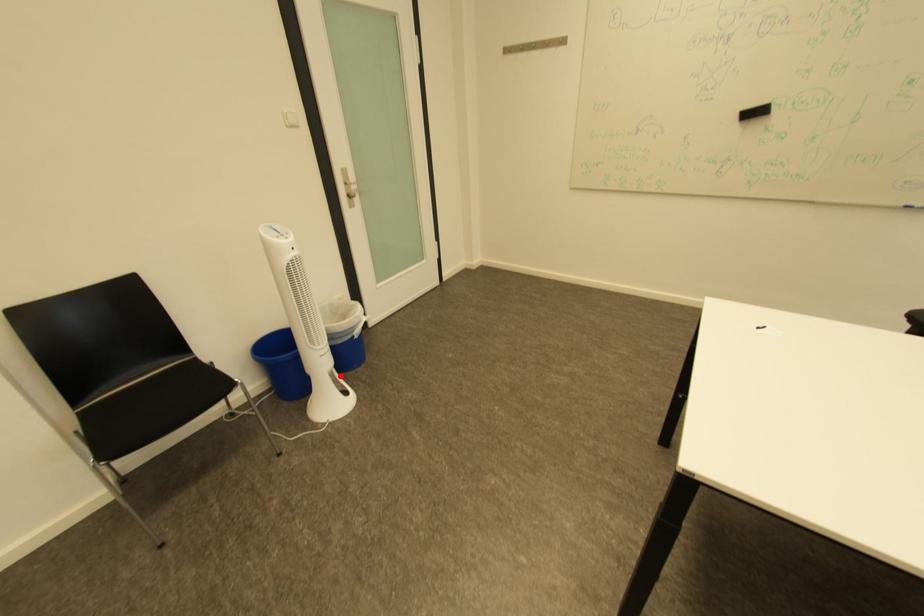
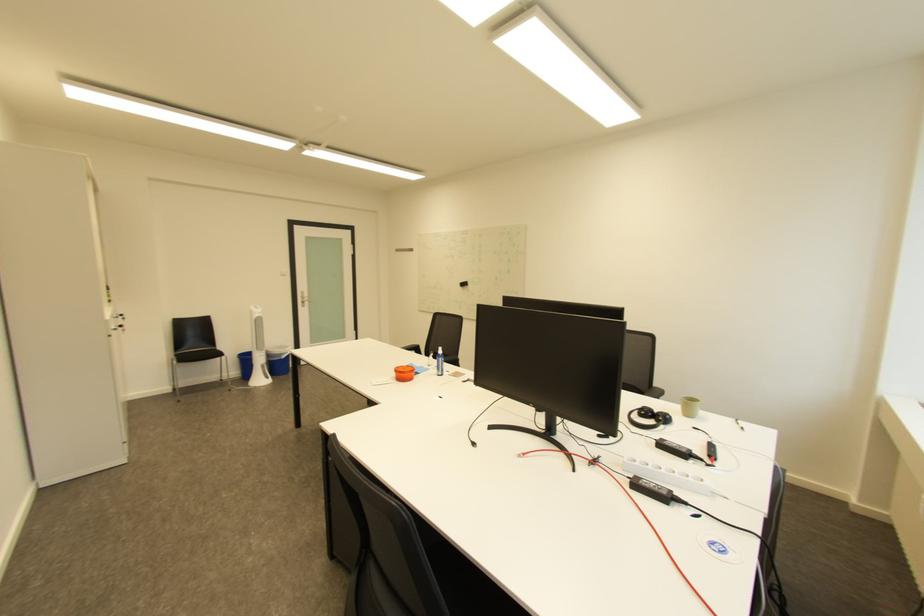
Find the pixel in the second image that matches the highlighted location in the first image.

(273, 367)